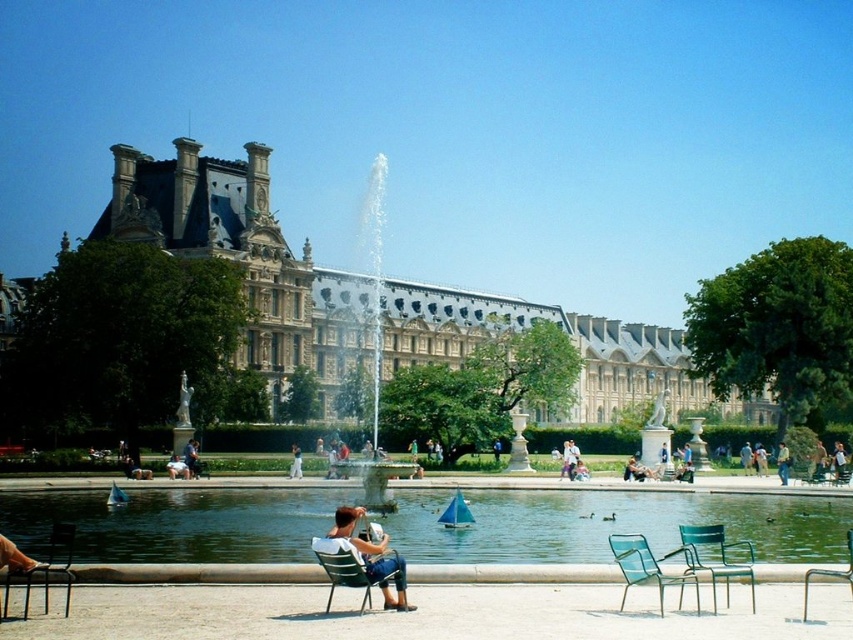
Question: Does stone building at center have a lesser width compared to metallic silver chair at lower center?

Choices:
 (A) yes
 (B) no

Answer: (B)

Question: Based on their relative distances, which object is nearer to the green woven chair at lower right?

Choices:
 (A) dark blue jeans at center
 (B) denim jeans at center
 (C) white fabric shirt at lower center
 (D) denim jacket at center

Answer: (B)

Question: Is metallic silver chair at lower center positioned behind smooth tan skin at lower left?

Choices:
 (A) yes
 (B) no

Answer: (A)

Question: Estimate the real-world distances between objects in this image. Which object is farther from the white fabric shirt at center?

Choices:
 (A) metallic black chair at lower left
 (B) dark blue jeans at center

Answer: (A)

Question: In this image, where is stone building at center located relative to denim jacket at center?

Choices:
 (A) left
 (B) right

Answer: (B)

Question: Which of the following is the closest to the observer?

Choices:
 (A) (103, 524)
 (B) (0, 548)
 (C) (781, 467)

Answer: (B)